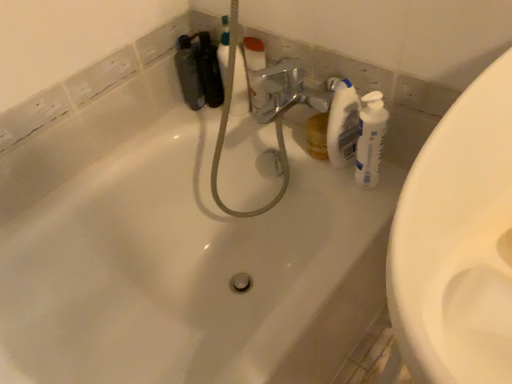
This screenshot has width=512, height=384. Identify the location of free space in front of matte black bottle at upper left. (200, 117).